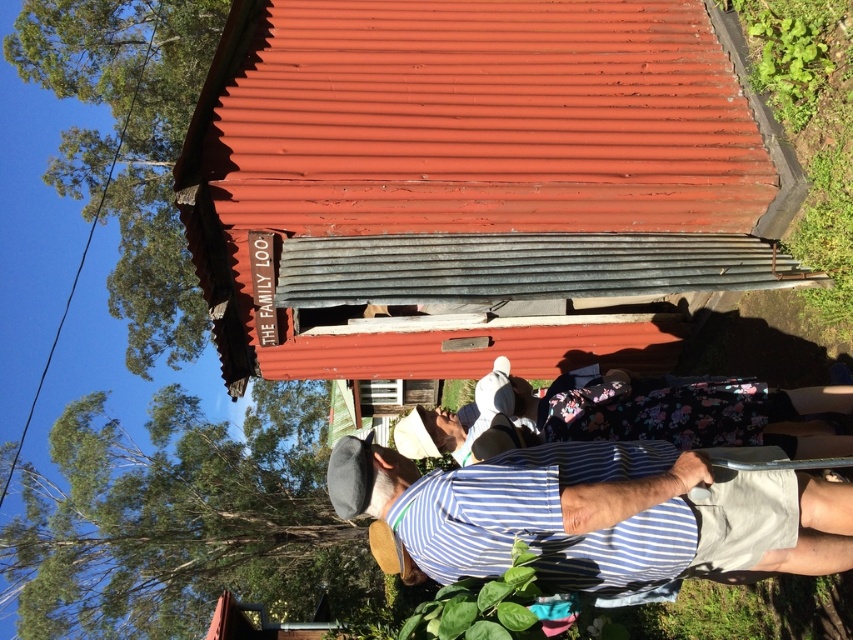
Is rusty corrugated metal hut at center further to camera compared to blue striped shirt at lower center?

Yes, it is.

Describe the element at coordinates (473, 179) in the screenshot. I see `rusty corrugated metal hut at center` at that location.

Is point (521, 106) less distant than point (440, 502)?

No, (521, 106) is further to viewer.

The width and height of the screenshot is (853, 640). In order to click on rusty corrugated metal hut at center in this screenshot , I will do `click(473, 179)`.